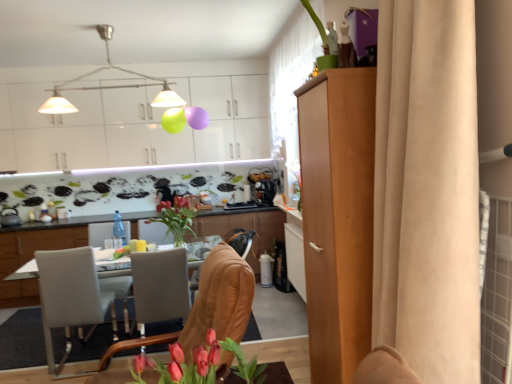
Question: Is point (101, 284) positioned closer to the camera than point (69, 337)?

Choices:
 (A) farther
 (B) closer

Answer: (A)

Question: Is white leather armchair at left to the left or to the right of white leather chair at lower left, which appears as the 2th chair when viewed from the right, in the image?

Choices:
 (A) left
 (B) right

Answer: (B)

Question: Based on their relative distances, which object is nearer to the white leather chair at lower left, the first chair from the back?

Choices:
 (A) beige fabric curtain at right, marked as the first curtain in a front-to-back arrangement
 (B) white glossy table at center, which is the 2th cabinetry from back to front
 (C) beige fabric curtain at upper right, the first curtain from the back
 (D) light brown wood cabinet at right, which is the 3th cabinetry in back-to-front order
 (E) white glossy desk at lower left

Answer: (E)

Question: Estimate the real-world distances between objects in this image. Which object is closer to the satin black coffee machine at center?

Choices:
 (A) metallic pendant lights at upper center
 (B) beige fabric curtain at upper right, the first curtain from the back
 (C) transparent plastic bottle at center
 (D) white glossy desk at lower left
 (E) white leather chair at lower left, which is the 2th chair in front-to-back order

Answer: (B)